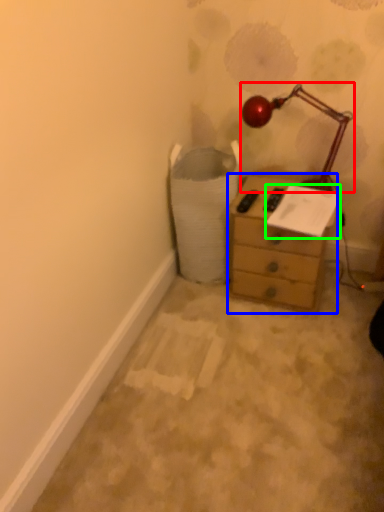
Question: Considering the real-world distances, which object is farthest from lamp (highlighted by a red box)? chest of drawers (highlighted by a blue box) or paper (highlighted by a green box)?

Choices:
 (A) chest of drawers
 (B) paper

Answer: (A)